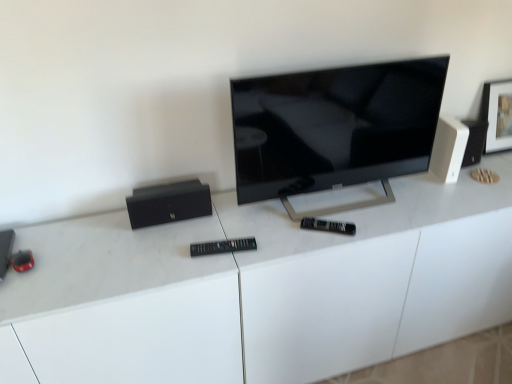
Where is `free point below black glossy tv at center (from a real-world perspective)`? The width and height of the screenshot is (512, 384). free point below black glossy tv at center (from a real-world perspective) is located at coordinates (339, 205).